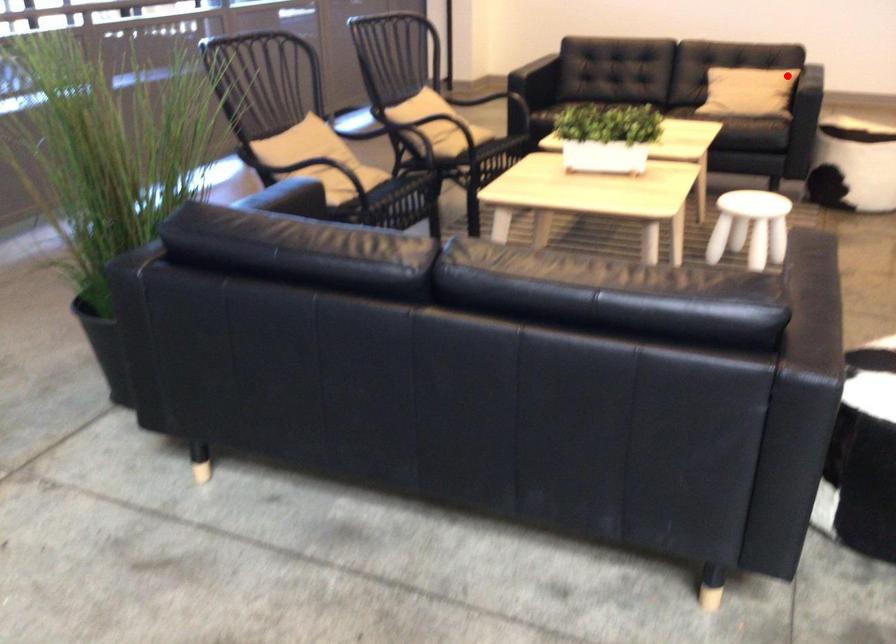
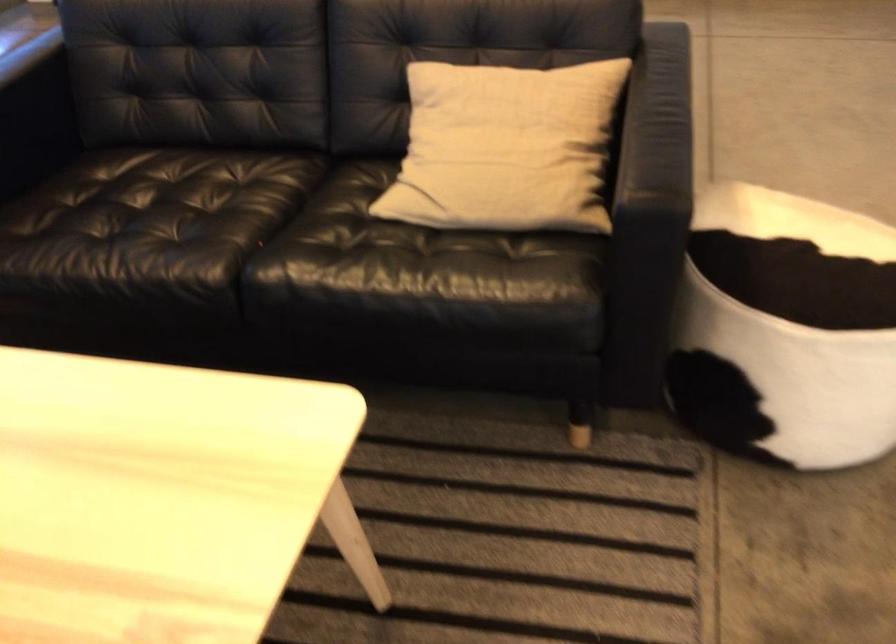
Find the pixel in the second image that matches the highlighted location in the first image.

(505, 147)